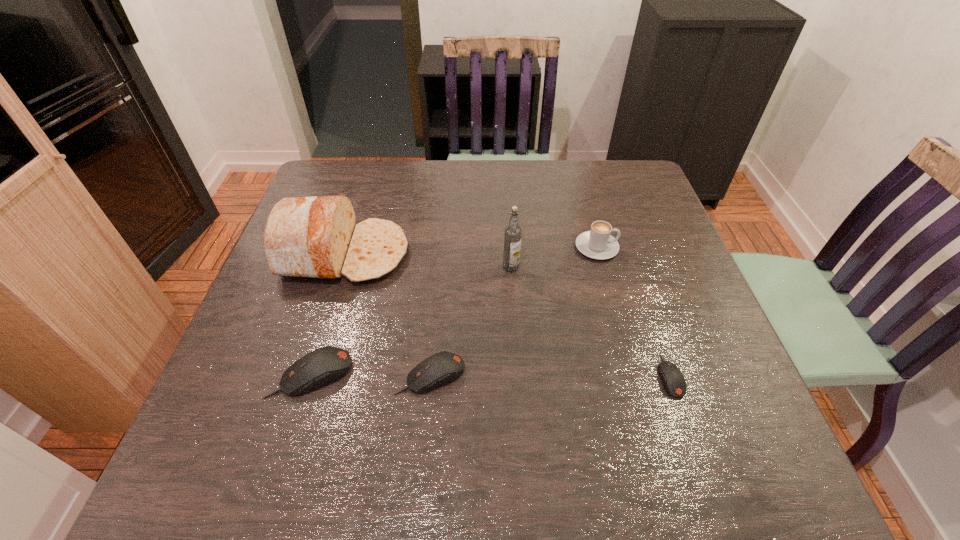
I want to click on vacant area that lies between the bread and the second computer mouse from right to left, so click(388, 314).

At what (x,y) coordinates should I click in order to perform the action: click on free space that is in between the cappuccino and the fifth tallest object. Please return your answer as a coordinate pair (x, y). This screenshot has width=960, height=540. Looking at the image, I should click on (514, 311).

Identify the location of free area in between the leftmost computer mouse and the fourth shortest object. (454, 310).

I want to click on vacant area that lies between the second tallest computer mouse and the leftmost computer mouse, so click(371, 374).

You are a GUI agent. You are given a task and a screenshot of the screen. Output one action in this format:
    pyautogui.click(x=<x>, y=<y>)
    Task: Click on the vacant space in between the leftmost computer mouse and the rightmost computer mouse
    This screenshot has height=540, width=960.
    Given the screenshot: What is the action you would take?
    pyautogui.click(x=491, y=375)

The height and width of the screenshot is (540, 960). Identify the location of vacant area that lies between the bread and the cappuccino. (470, 251).

Select which object is the closest to the vodka. Please provide its 2D coordinates. Your answer should be formatted as a tuple, i.e. [(x, y)], where the tuple contains the x and y coordinates of a point satisfying the conditions above.

[(598, 243)]

Select which object appears as the second closest to the second tallest computer mouse. Please provide its 2D coordinates. Your answer should be formatted as a tuple, i.e. [(x, y)], where the tuple contains the x and y coordinates of a point satisfying the conditions above.

[(316, 237)]

Where is `the second closest computer mouse relative to the fifth tallest object`? The width and height of the screenshot is (960, 540). the second closest computer mouse relative to the fifth tallest object is located at coordinates (673, 382).

Locate which computer mouse ranks third in proximity to the cappuccino. Please provide its 2D coordinates. Your answer should be formatted as a tuple, i.e. [(x, y)], where the tuple contains the x and y coordinates of a point satisfying the conditions above.

[(325, 365)]